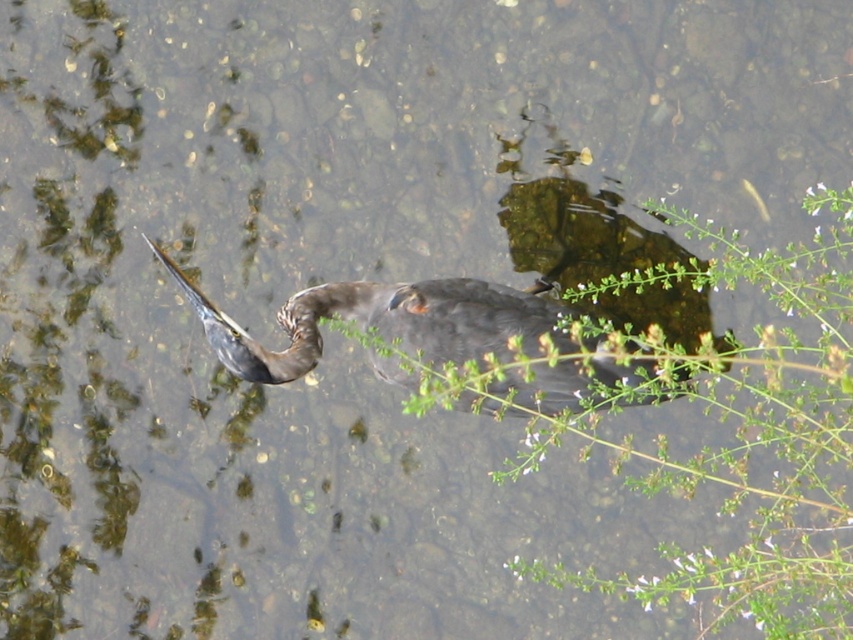
You are a photographer trying to capture the green leafy plant at center and dark brown feathers at center in a single frame. Given that your camera has a maximum focus range of 14 inches, will both objects be in focus?

The green leafy plant at center and dark brown feathers at center are 14.51 inches apart from each other. Since the distance between them exceeds the camera focus range of 14 inches, both objects cannot be in focus simultaneously.

You are a photographer trying to capture the dark brown feathers at center and the green leafy plant at center in the same frame. Based on their positions, which object should you adjust your camera to focus on first to ensure both are in the shot?

The green leafy plant at center is positioned on the right side of dark brown feathers at center, so you should focus on the dark brown feathers at center first as it is closer to the left side, ensuring both objects remain in frame.

You are a photographer trying to capture the bird in the scene. You notice two points marked in the image. The first point is at coordinates point (828, 285) and the second is at point (527, 385). Which point is closer to the camera?

Point (527, 385) is closer to the camera than point (828, 285) because the description states that point (828, 285) is further away.